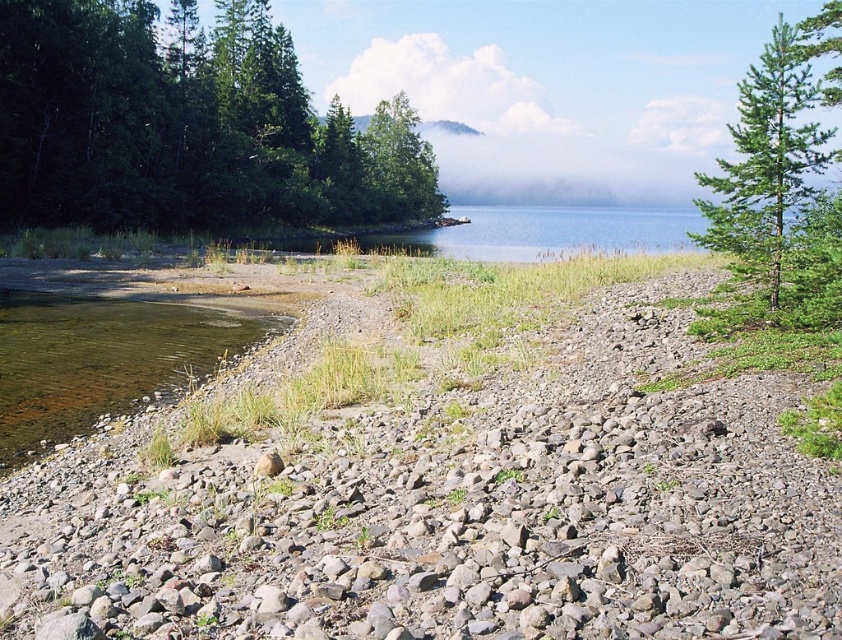
Between gray gravel at lower left and green leafy tree at left, which one is positioned higher?

green leafy tree at left is higher up.

Does point (358, 550) come farther from viewer compared to point (13, 156)?

No, (358, 550) is closer to viewer.

Where is `gray gravel at lower left`? The height and width of the screenshot is (640, 842). gray gravel at lower left is located at coordinates (440, 484).

Is gray gravel at lower left wider than green textured pine tree at upper right?

No, gray gravel at lower left is not wider than green textured pine tree at upper right.

Consider the image. Is gray gravel at lower left bigger than green textured pine tree at upper right?

No.

Locate an element on the screen. This screenshot has height=640, width=842. gray gravel at lower left is located at coordinates (440, 484).

Find the location of a particular element. The image size is (842, 640). gray gravel at lower left is located at coordinates (440, 484).

Is point (294, 104) positioned after point (718, 225)?

Yes.

Is green leafy tree at left wider than green textured pine tree at upper right?

No, green leafy tree at left is not wider than green textured pine tree at upper right.

Is point (32, 77) positioned before point (774, 64)?

No, (32, 77) is further to viewer.

Identify the location of green leafy tree at left. (187, 125).